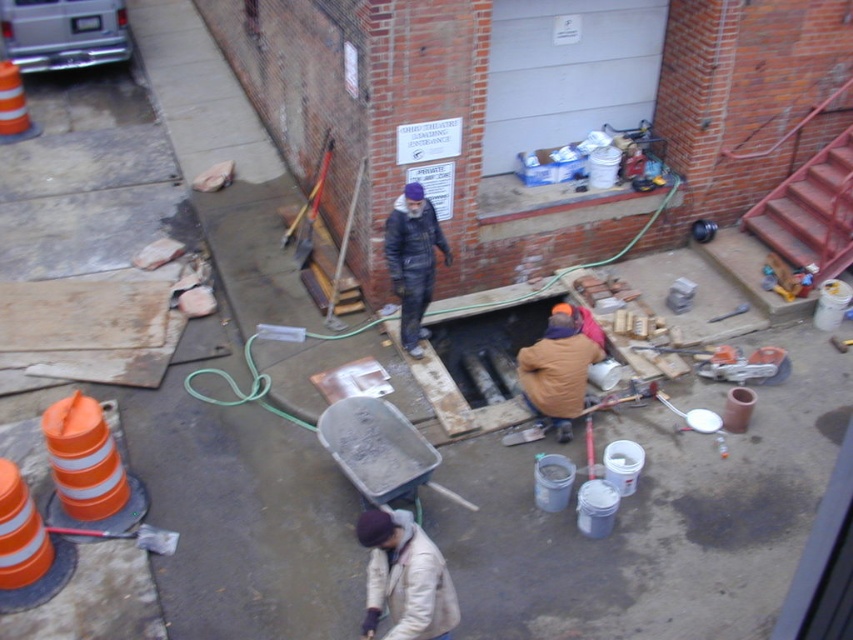
Which of these two, orange fuzzy hat at lower center or dark blue denim overalls at center, stands shorter?

orange fuzzy hat at lower center is shorter.

Based on the photo, is orange fuzzy hat at lower center below dark blue denim overalls at center?

Indeed, orange fuzzy hat at lower center is positioned under dark blue denim overalls at center.

Which is behind, point (558, 372) or point (424, 211)?

Positioned behind is point (424, 211).

Find the location of a particular element. orange fuzzy hat at lower center is located at coordinates (556, 371).

Can you confirm if dark blue denim overalls at center is shorter than orange reflective traffic cone at left?

No.

Describe the element at coordinates (413, 259) in the screenshot. I see `dark blue denim overalls at center` at that location.

You are a GUI agent. You are given a task and a screenshot of the screen. Output one action in this format:
    pyautogui.click(x=<x>, y=<y>)
    Task: Click on the dark blue denim overalls at center
    This screenshot has height=640, width=853.
    Given the screenshot: What is the action you would take?
    pyautogui.click(x=413, y=259)

Does orange fuzzy hat at lower center have a greater width compared to orange reflective traffic cone at left?

Correct, the width of orange fuzzy hat at lower center exceeds that of orange reflective traffic cone at left.

Does point (554, 413) lie in front of point (15, 131)?

Yes, point (554, 413) is in front of point (15, 131).

Locate an element on the screen. The width and height of the screenshot is (853, 640). orange fuzzy hat at lower center is located at coordinates (556, 371).